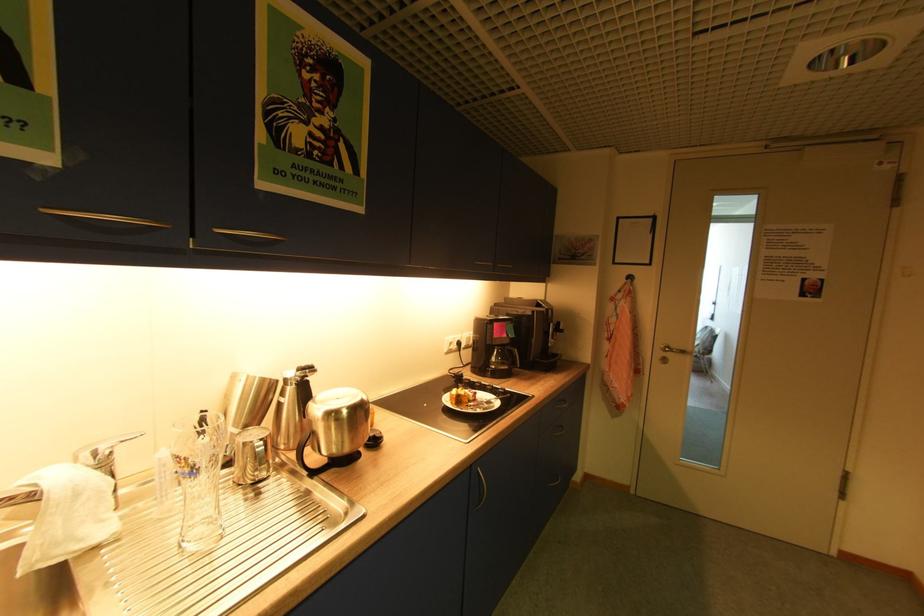
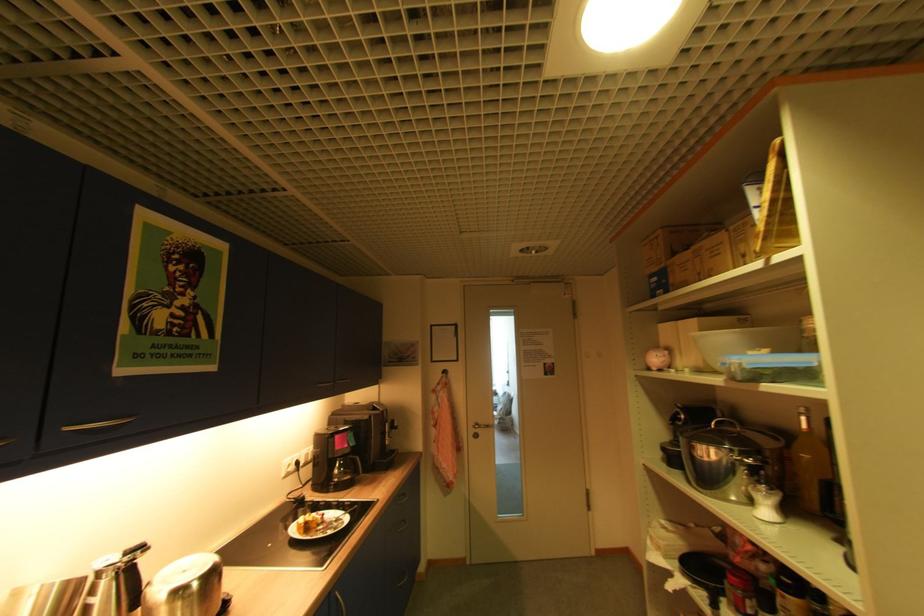
Where in the second image is the point corresponding to point (476, 468) from the first image?

(335, 593)